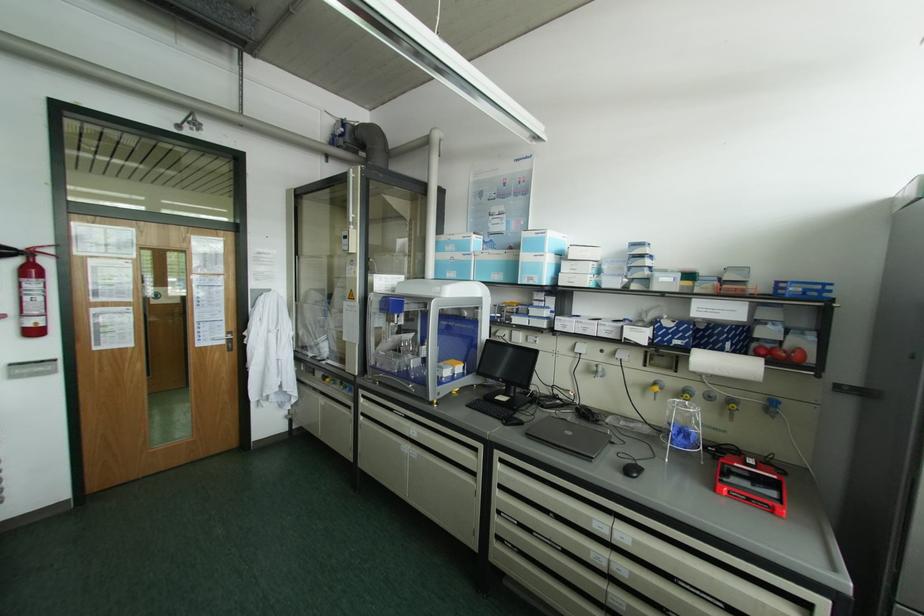
What do you see at coordinates (416, 347) in the screenshot? I see `a machine front panel` at bounding box center [416, 347].